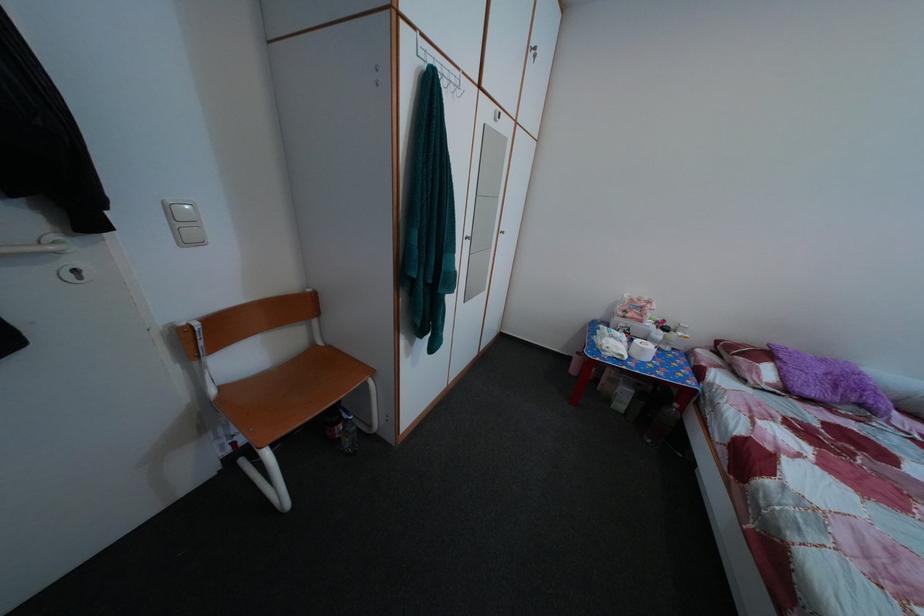
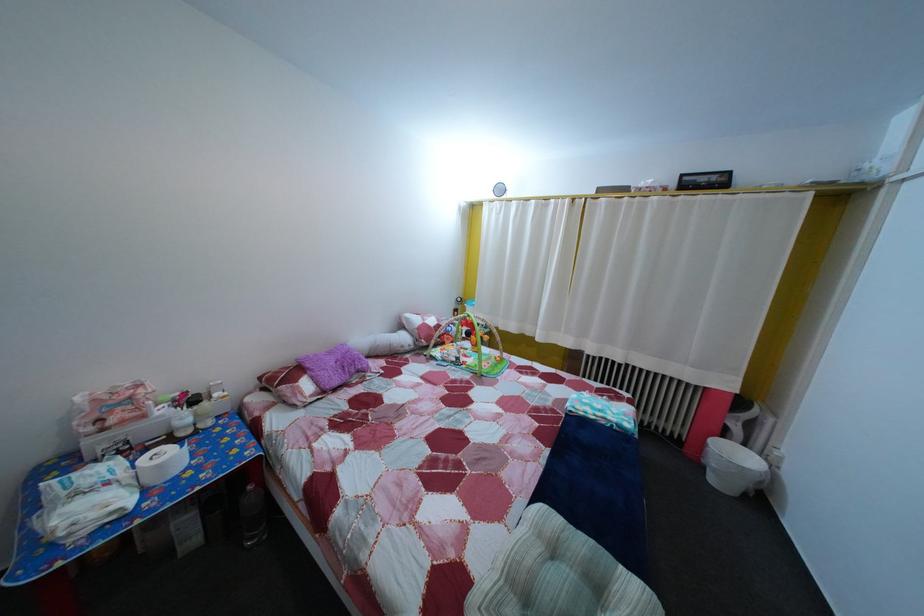
How did the camera likely rotate?

The camera's rotation is toward right-down.